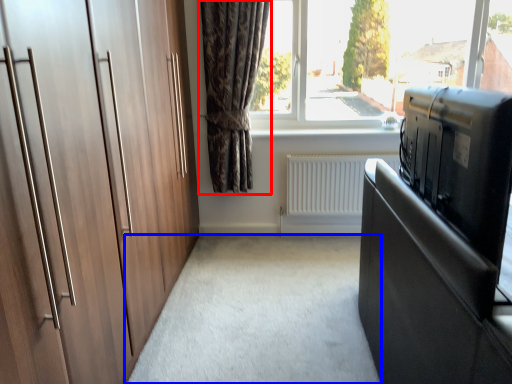
Question: Which object appears closest to the camera in this image, curtain (highlighted by a red box) or plain (highlighted by a blue box)?

Choices:
 (A) curtain
 (B) plain

Answer: (B)